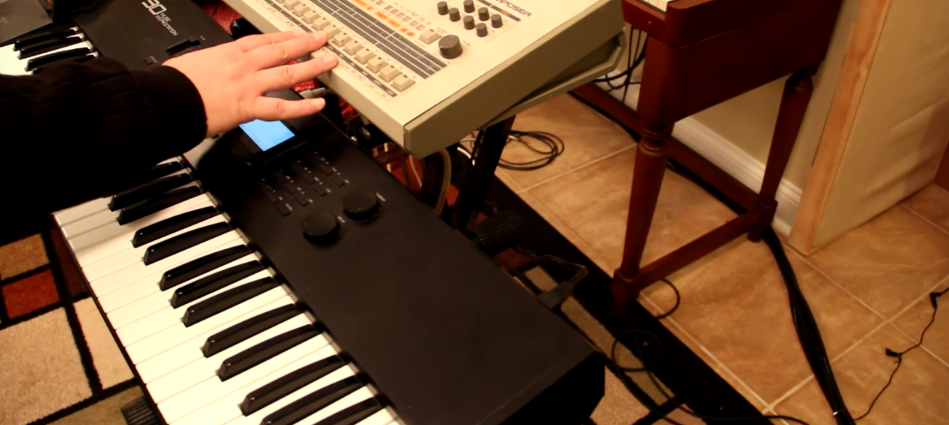
Identify the location of wooden table. The image size is (949, 425). (753, 43).